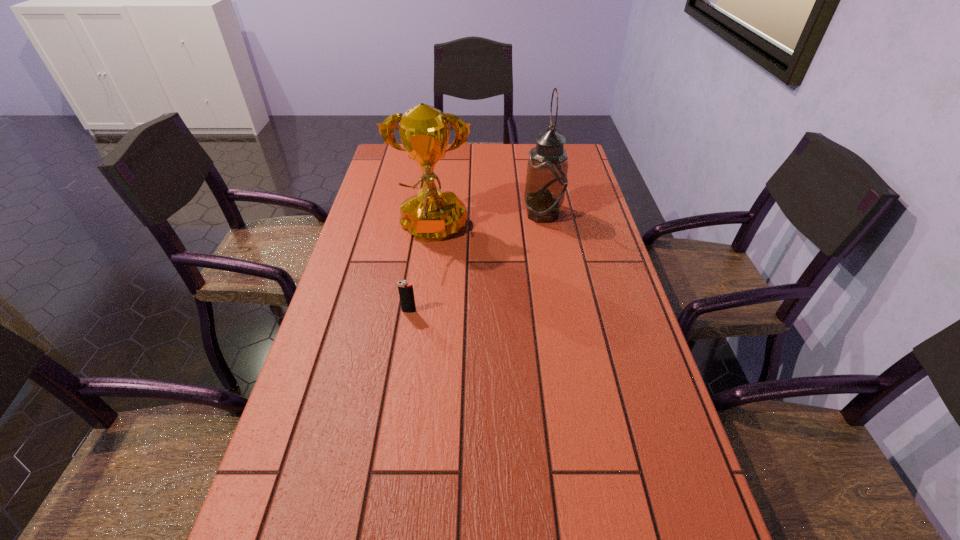
The width and height of the screenshot is (960, 540). I want to click on the rightmost object, so click(x=546, y=181).

You are a GUI agent. You are given a task and a screenshot of the screen. Output one action in this format:
    pyautogui.click(x=<x>, y=<y>)
    Task: Click on the award
    
    Given the screenshot: What is the action you would take?
    pyautogui.click(x=431, y=215)

Identify the location of igniter. The image size is (960, 540). (406, 293).

Identify the location of the shortest object. The image size is (960, 540). (406, 293).

Identify the location of vacant space situated on the back of the rightmost object. (533, 156).

Identify the location of vacant region located 0.110m on the front side of the award. This screenshot has height=540, width=960. (425, 285).

Image resolution: width=960 pixels, height=540 pixels. In order to click on vacant area situated 0.280m on the front of the nearest object in this screenshot , I will do `click(393, 414)`.

Locate an element on the screen. The height and width of the screenshot is (540, 960). object that is at the left edge is located at coordinates (431, 215).

The height and width of the screenshot is (540, 960). Find the location of `object present at the right edge`. object present at the right edge is located at coordinates (546, 181).

The height and width of the screenshot is (540, 960). In order to click on free region at the far edge of the desktop in this screenshot , I will do `click(473, 170)`.